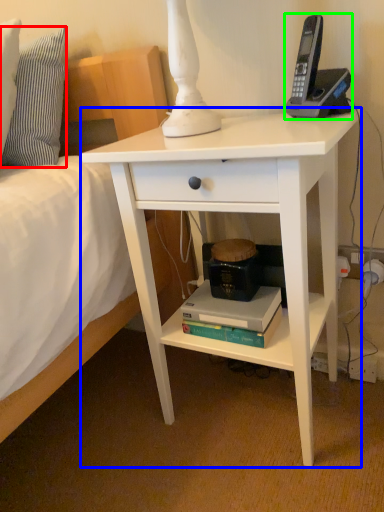
Question: Considering the real-world distances, which object is closest to pillow (highlighted by a red box)? desk (highlighted by a blue box) or corded phone (highlighted by a green box).

Choices:
 (A) desk
 (B) corded phone

Answer: (A)